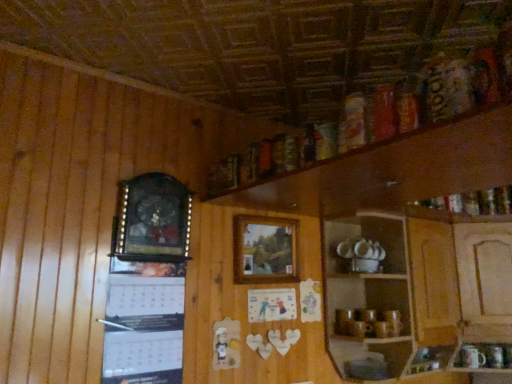
Question: Which direction should I rotate to look at wooden picture frame at center, which is counted as the second picture frame, starting from the front, — up or down?

Choices:
 (A) down
 (B) up

Answer: (A)

Question: From the image's perspective, is white paper calendar at upper left located beneath wooden picture frame at left, which ranks as the 1th picture frame in left-to-right order?

Choices:
 (A) yes
 (B) no

Answer: (A)

Question: Does white paper calendar at upper left have a lesser width compared to wooden picture frame at left, which appears as the second picture frame when viewed from the right?

Choices:
 (A) yes
 (B) no

Answer: (A)

Question: From a real-world perspective, is white paper calendar at upper left on top of wooden picture frame at left, which appears as the second picture frame when viewed from the right?

Choices:
 (A) yes
 (B) no

Answer: (B)

Question: Could you tell me if white paper calendar at upper left is turned towards wooden picture frame at left, which ranks as the 1th picture frame in left-to-right order?

Choices:
 (A) no
 (B) yes

Answer: (B)

Question: Can you confirm if white paper calendar at upper left is positioned to the left of wooden picture frame at left, which appears as the second picture frame when viewed from the right?

Choices:
 (A) yes
 (B) no

Answer: (A)

Question: Are white paper calendar at upper left and wooden picture frame at left, which ranks as the 1th picture frame in left-to-right order, located far from each other?

Choices:
 (A) yes
 (B) no

Answer: (B)

Question: Is wooden cabinet at lower right touching wooden picture frame at left, which appears as the second picture frame when viewed from the right?

Choices:
 (A) no
 (B) yes

Answer: (A)

Question: Is wooden cabinet at lower right outside wooden picture frame at left, which appears as the second picture frame when viewed from the right?

Choices:
 (A) yes
 (B) no

Answer: (A)

Question: Considering the relative positions of wooden cabinet at lower right and wooden picture frame at left, which appears as the second picture frame when viewed from the right, in the image provided, is wooden cabinet at lower right behind wooden picture frame at left, which appears as the second picture frame when viewed from the right,?

Choices:
 (A) no
 (B) yes

Answer: (B)

Question: Considering the relative sizes of wooden cabinet at lower right and wooden picture frame at left, the 2th picture frame viewed from the back, in the image provided, is wooden cabinet at lower right thinner than wooden picture frame at left, the 2th picture frame viewed from the back,?

Choices:
 (A) yes
 (B) no

Answer: (B)

Question: From the image's perspective, is wooden cabinet at lower right beneath wooden picture frame at left, the 1th picture frame in the front-to-back sequence?

Choices:
 (A) yes
 (B) no

Answer: (A)

Question: From the image's perspective, does wooden cabinet at lower right appear higher than wooden picture frame at left, the 1th picture frame in the front-to-back sequence?

Choices:
 (A) no
 (B) yes

Answer: (A)

Question: From a real-world perspective, is wooden picture frame at left, the 2th picture frame viewed from the back, beneath white paper calendar at upper left?

Choices:
 (A) yes
 (B) no

Answer: (B)